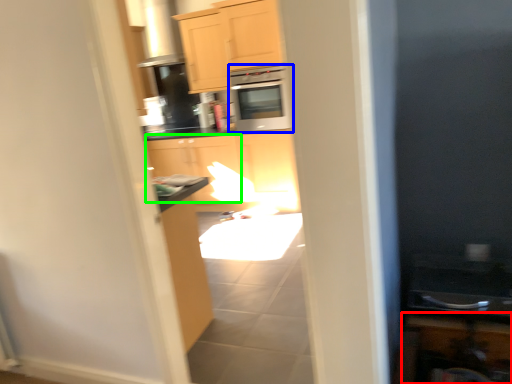
Question: Which object is positioned farthest from cabinetry (highlighted by a red box)? Select from microwave oven (highlighted by a blue box) and cabinetry (highlighted by a green box).

Choices:
 (A) microwave oven
 (B) cabinetry

Answer: (A)